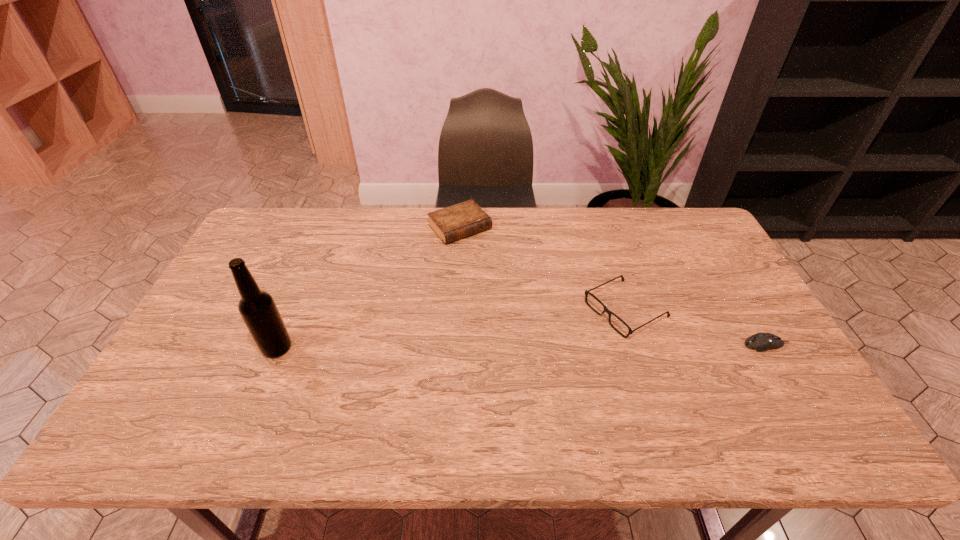
The image size is (960, 540). In order to click on empty space between the leftmost object and the computer mouse in this screenshot , I will do `click(521, 346)`.

Point out which object is positioned as the third nearest to the third object from right to left. Please provide its 2D coordinates. Your answer should be formatted as a tuple, i.e. [(x, y)], where the tuple contains the x and y coordinates of a point satisfying the conditions above.

[(761, 342)]

At what (x,y) coordinates should I click in order to perform the action: click on object that ranks as the second closest to the second object from right to left. Please return your answer as a coordinate pair (x, y). Looking at the image, I should click on (458, 221).

The image size is (960, 540). I want to click on vacant region that satisfies the following two spatial constraints: 1. on the front side of the computer mouse; 2. on the left side of the third object from left to right, so click(637, 345).

Identify the location of free spot that satisfies the following two spatial constraints: 1. on the back side of the tallest object; 2. on the right side of the diary. (327, 227).

The height and width of the screenshot is (540, 960). I want to click on vacant point that satisfies the following two spatial constraints: 1. on the back side of the third object from left to right; 2. on the right side of the leftmost object, so pyautogui.click(x=293, y=309).